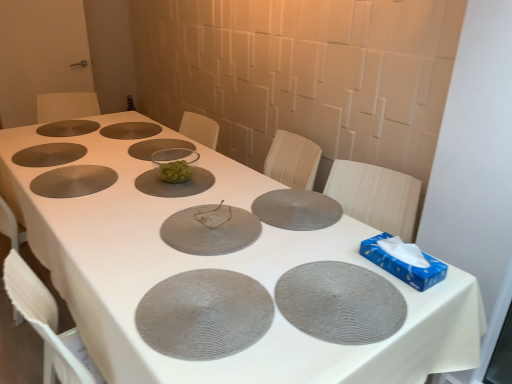
Identify the location of vacant space in gray textured placemat at lower right, arranged as the ninth glass plate when viewed from the back (from a real-world perspective). The height and width of the screenshot is (384, 512). (323, 286).